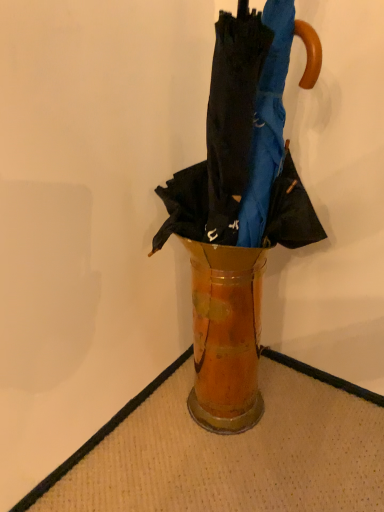
Image resolution: width=384 pixels, height=512 pixels. What are the coordinates of `translucent amber vase at center` in the screenshot? It's located at (226, 335).

This screenshot has height=512, width=384. What do you see at coordinates (226, 335) in the screenshot?
I see `translucent amber vase at center` at bounding box center [226, 335].

Image resolution: width=384 pixels, height=512 pixels. I want to click on translucent amber vase at center, so click(226, 335).